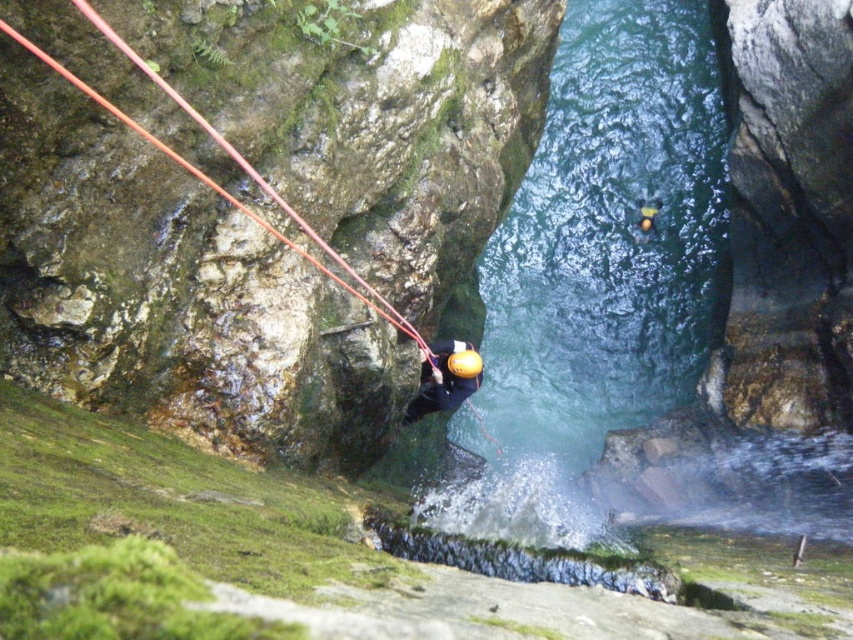
Is clear blue water at center in front of smooth red rope at upper left?

Yes, it is in front of smooth red rope at upper left.

Who is shorter, clear blue water at center or smooth red rope at upper left?

smooth red rope at upper left is shorter.

Between point (558, 188) and point (79, 80), which one is positioned in front?

Point (79, 80) is more forward.

Locate an element on the screen. This screenshot has height=640, width=853. clear blue water at center is located at coordinates (596, 276).

Does smooth red rope at upper left appear on the right side of matte yellow helmet at center?

In fact, smooth red rope at upper left is to the left of matte yellow helmet at center.

Is smooth red rope at upper left below matte yellow helmet at center?

Incorrect, smooth red rope at upper left is not positioned below matte yellow helmet at center.

Where is `smooth red rope at upper left`? The height and width of the screenshot is (640, 853). smooth red rope at upper left is located at coordinates (215, 180).

Image resolution: width=853 pixels, height=640 pixels. What are the coordinates of `smooth red rope at upper left` in the screenshot? It's located at (215, 180).

Is clear blue water at center in front of matte yellow helmet at center?

Yes, it is.

What do you see at coordinates (596, 276) in the screenshot?
I see `clear blue water at center` at bounding box center [596, 276].

At what (x,y) coordinates should I click in order to perform the action: click on clear blue water at center. Please return your answer as a coordinate pair (x, y). The image size is (853, 640). Looking at the image, I should click on (596, 276).